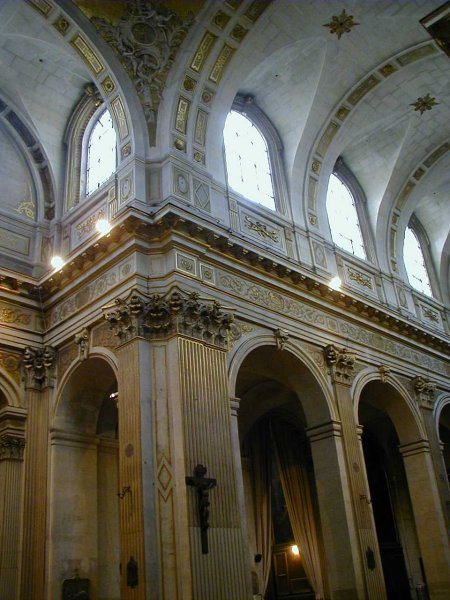
At what (x,y) coordinates should I click in order to perform the action: click on ornaments. Please return your answer as a coordinate pair (x, y). The image size is (450, 600). Looking at the image, I should click on (343, 23), (425, 102).